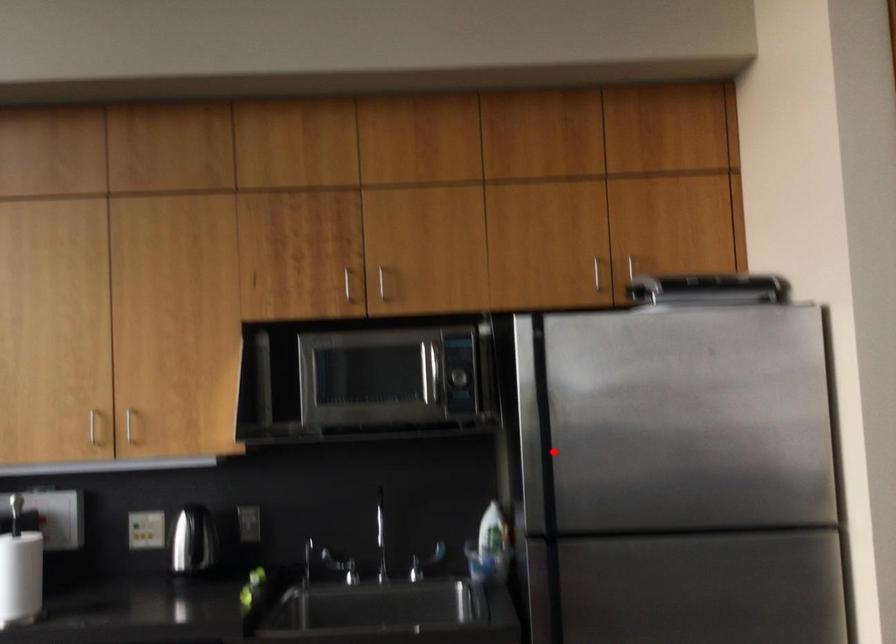
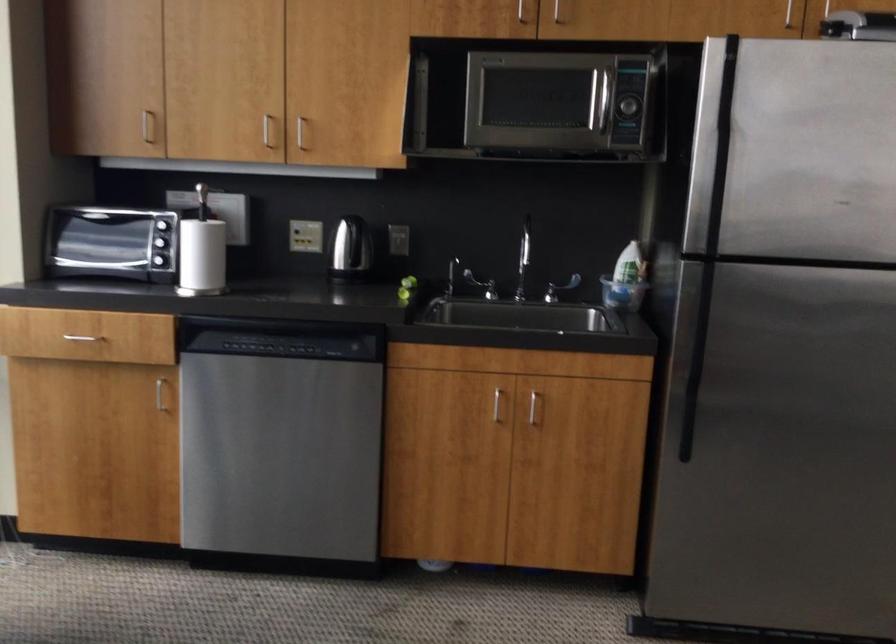
Where in the second image is the point corresponding to the highlighted location from the first image?

(718, 184)